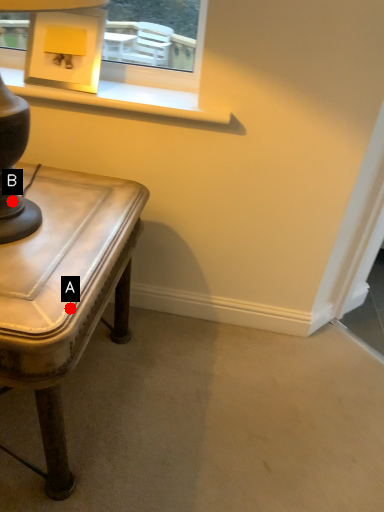
Question: Two points are circled on the image, labeled by A and B beside each circle. Which point is farther from the camera taking this photo?

Choices:
 (A) A is further
 (B) B is further

Answer: (B)